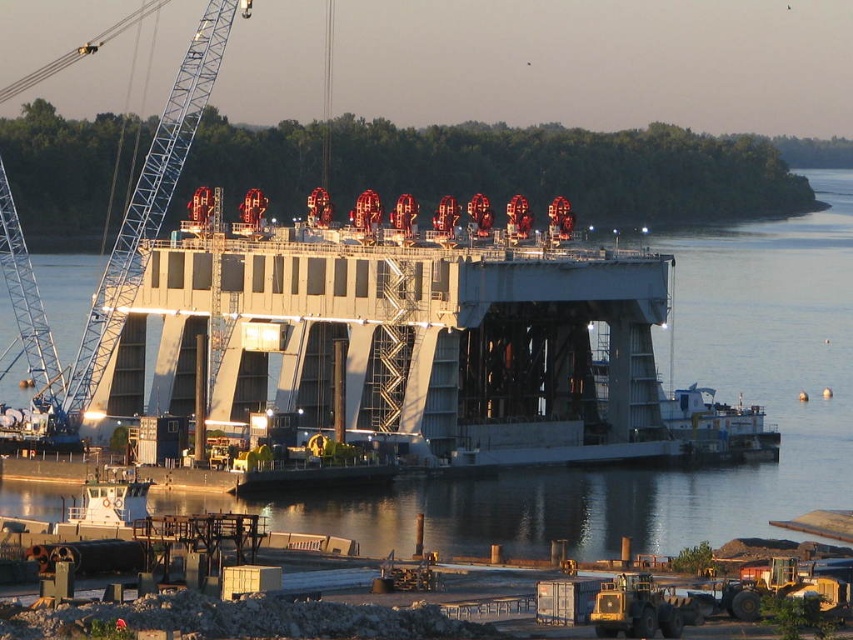
Question: Among these objects, which one is farthest from the camera?

Choices:
 (A) metallic water at center
 (B) blue metallic crane at left

Answer: (B)

Question: Which of the following is the farthest from the observer?

Choices:
 (A) metallic water at center
 (B) blue metallic crane at left

Answer: (B)

Question: Is metallic water at center above blue metallic crane at left?

Choices:
 (A) yes
 (B) no

Answer: (B)

Question: Can you confirm if metallic water at center is smaller than blue metallic crane at left?

Choices:
 (A) yes
 (B) no

Answer: (B)

Question: Does metallic water at center have a larger size compared to blue metallic crane at left?

Choices:
 (A) yes
 (B) no

Answer: (A)